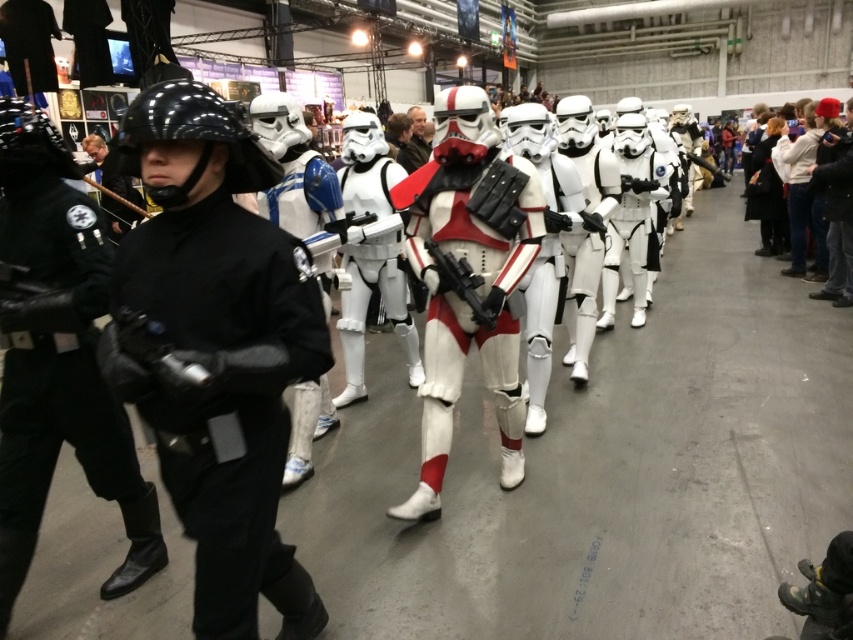
You are a photographer at the event and need to capture a photo that includes both the black matte uniform at center and the white matte helmet at upper right. Based on their widths, which object should you position closer to the edge of the frame to ensure both fit in the shot?

Since the black matte uniform at center might be wider than the white matte helmet at upper right, you should position the wider black matte uniform at center closer to the center of the frame and the narrower white matte helmet at upper right near the edge to ensure both fit in the shot.

You are standing in the convention hall and want to reach a specific point marked at coordinates point (181,381). If your height is 5.5 feet, will you be able to see over the crowd without any obstruction?

The distance of point (181,381) from viewer is 4.28 feet. Since the distance is relatively short and your height is 5.5 feet, you should be able to see over the crowd unless there are tall obstacles in the way.